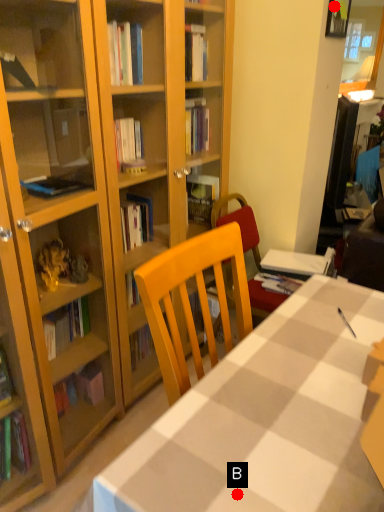
Question: Two points are circled on the image, labeled by A and B beside each circle. Which point appears closest to the camera in this image?

Choices:
 (A) A is closer
 (B) B is closer

Answer: (B)